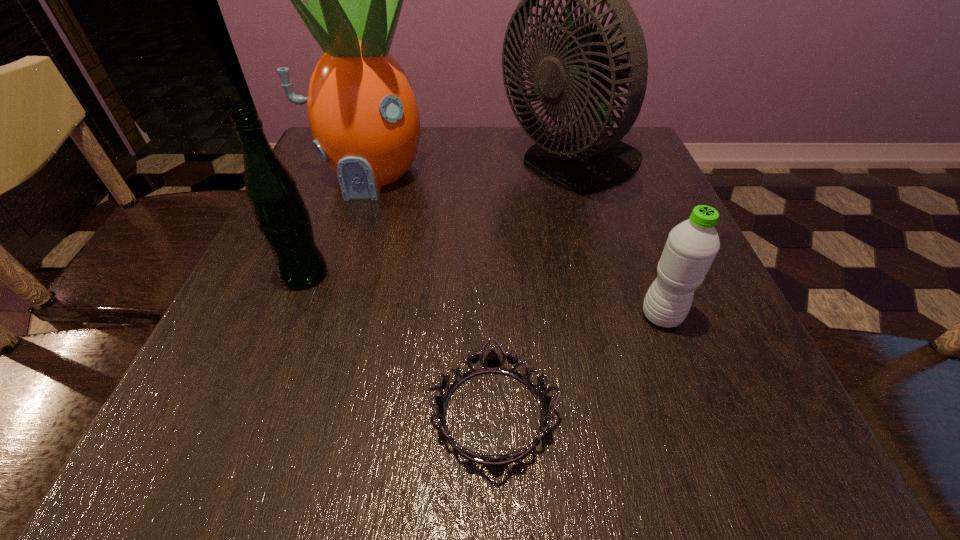
In order to click on pineapple in this screenshot , I will do `click(362, 110)`.

Locate an element on the screen. The height and width of the screenshot is (540, 960). fan is located at coordinates (585, 71).

The image size is (960, 540). What are the coordinates of `beer bottle` in the screenshot? It's located at (281, 216).

The image size is (960, 540). What are the coordinates of `the third farthest object` in the screenshot? It's located at (281, 216).

Find the location of `water bottle`. water bottle is located at coordinates (692, 245).

Find the location of a particular element. The width and height of the screenshot is (960, 540). the fourth tallest object is located at coordinates (692, 245).

The image size is (960, 540). I want to click on the nearest object, so click(x=492, y=363).

Locate an element on the screen. This screenshot has width=960, height=540. the shortest object is located at coordinates (492, 363).

The height and width of the screenshot is (540, 960). In order to click on free spot located 0.270m at the entrance of the pineapple in this screenshot , I will do `click(325, 304)`.

Locate an element on the screen. The image size is (960, 540). vacant space located in front of the fan to direct airflow is located at coordinates (414, 167).